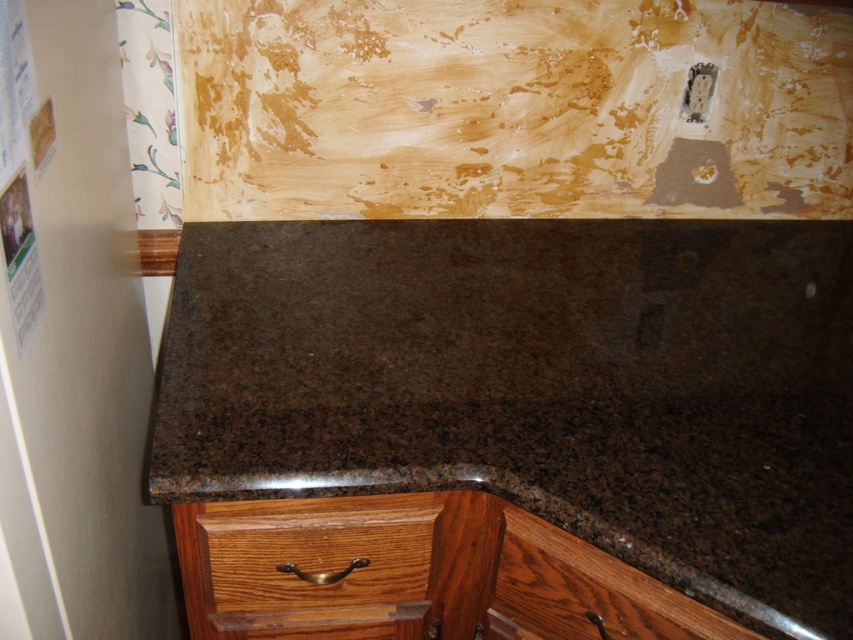
Question: Is brown granite countertop at center below brown wood drawer at lower center?

Choices:
 (A) no
 (B) yes

Answer: (A)

Question: Is brown granite countertop at center wider than brown wood drawer at lower center?

Choices:
 (A) yes
 (B) no

Answer: (A)

Question: Which point appears closest to the camera in this image?

Choices:
 (A) (173, 358)
 (B) (407, 550)

Answer: (B)

Question: Among these objects, which one is nearest to the camera?

Choices:
 (A) brown granite countertop at center
 (B) brown wood drawer at lower center

Answer: (A)

Question: Is brown granite countertop at center below brown wood drawer at lower center?

Choices:
 (A) no
 (B) yes

Answer: (A)

Question: Which of the following is the closest to the observer?

Choices:
 (A) brown wood drawer at lower center
 (B) brown granite countertop at center

Answer: (B)